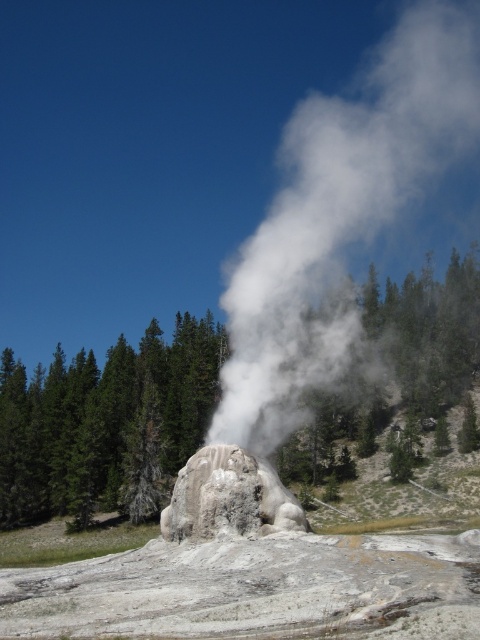
Question: From the image, what is the correct spatial relationship of green textured tree at center in relation to gray stone geyser at center?

Choices:
 (A) right
 (B) left

Answer: (A)

Question: Which of the following is the farthest from the observer?

Choices:
 (A) gray stone geyser at center
 (B) white vapor at center

Answer: (B)

Question: Can you confirm if white vapor at center is bigger than gray stone geyser at center?

Choices:
 (A) no
 (B) yes

Answer: (B)

Question: Can you confirm if white vapor at center is bigger than gray stone geyser at center?

Choices:
 (A) yes
 (B) no

Answer: (A)

Question: Which object is closer to the camera taking this photo?

Choices:
 (A) white vapor at center
 (B) green textured tree at center
 (C) gray stone geyser at center

Answer: (C)

Question: Which point appears farthest from the camera in this image?

Choices:
 (A) pyautogui.click(x=24, y=483)
 (B) pyautogui.click(x=402, y=80)

Answer: (B)